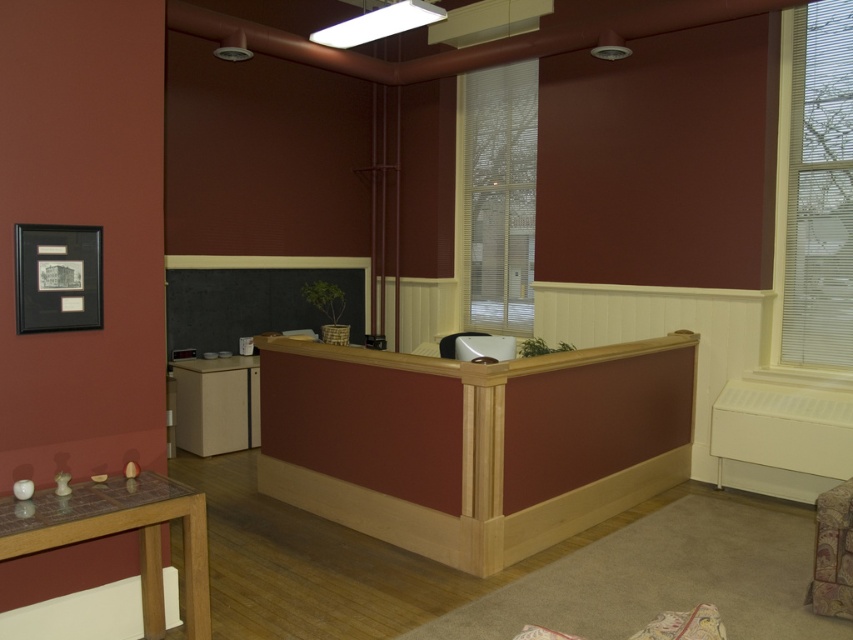
You are standing at the reception desk and want to move towards the exit located at point (486, 344). There is an obstacle at point (256, 444). Will you encounter the obstacle before reaching the exit?

Point (256, 444) is behind point (486, 344), so you will reach the exit at point (486, 344) before encountering the obstacle at point (256, 444).

You are designing a layout for a new office and need to place a 2.5 meter wide sofa between the white mesh window at center and the matte glass table at lower left. Can the sofa fit horizontally between them?

The white mesh window at center is narrower than the matte glass table at lower left, but the exact distance between them isn generated from the provided information. Therefore, it is unclear if the 2.5 meter wide sofa can fit horizontally between them.

You are standing in the reception area and looking at two points marked on the floor. The first point is at coordinates point (483, 280) and the second point is at point (36, 500). Which point is closer to you?

Point (483, 280) is further to the viewer than point (36, 500), so the second point is closer to you.